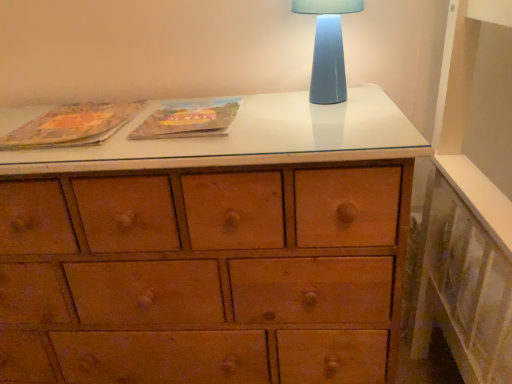
Question: Should I look upward or downward to see matte paper book at upper left, placed as the second paperback book when sorted from right to left?

Choices:
 (A) down
 (B) up

Answer: (B)

Question: Is blue ceramic table lamp at upper right thinner than matte cardboard book at center, marked as the first paperback book in a right-to-left arrangement?

Choices:
 (A) yes
 (B) no

Answer: (A)

Question: From the image's perspective, would you say blue ceramic table lamp at upper right is shown under matte cardboard book at center, marked as the second paperback book in a left-to-right arrangement?

Choices:
 (A) no
 (B) yes

Answer: (A)

Question: Is blue ceramic table lamp at upper right bigger than matte cardboard book at center, marked as the first paperback book in a right-to-left arrangement?

Choices:
 (A) no
 (B) yes

Answer: (B)

Question: Is blue ceramic table lamp at upper right facing away from matte cardboard book at center, marked as the first paperback book in a right-to-left arrangement?

Choices:
 (A) no
 (B) yes

Answer: (A)

Question: Is blue ceramic table lamp at upper right facing towards matte cardboard book at center, marked as the second paperback book in a left-to-right arrangement?

Choices:
 (A) no
 (B) yes

Answer: (A)

Question: Is the position of blue ceramic table lamp at upper right less distant than that of matte cardboard book at center, marked as the second paperback book in a left-to-right arrangement?

Choices:
 (A) yes
 (B) no

Answer: (B)

Question: From a real-world perspective, is matte paper book at upper left, marked as the first paperback book in a left-to-right arrangement, positioned over blue ceramic table lamp at upper right based on gravity?

Choices:
 (A) yes
 (B) no

Answer: (B)

Question: Could you tell me if matte paper book at upper left, placed as the second paperback book when sorted from right to left, is facing blue ceramic table lamp at upper right?

Choices:
 (A) no
 (B) yes

Answer: (A)

Question: Considering the relative positions of matte paper book at upper left, marked as the first paperback book in a left-to-right arrangement, and blue ceramic table lamp at upper right in the image provided, is matte paper book at upper left, marked as the first paperback book in a left-to-right arrangement, to the right of blue ceramic table lamp at upper right from the viewer's perspective?

Choices:
 (A) no
 (B) yes

Answer: (A)

Question: Is matte paper book at upper left, marked as the first paperback book in a left-to-right arrangement, next to blue ceramic table lamp at upper right and touching it?

Choices:
 (A) yes
 (B) no

Answer: (B)

Question: Is matte paper book at upper left, marked as the first paperback book in a left-to-right arrangement, wider than blue ceramic table lamp at upper right?

Choices:
 (A) no
 (B) yes

Answer: (B)

Question: Does matte paper book at upper left, placed as the second paperback book when sorted from right to left, have a lesser width compared to blue ceramic table lamp at upper right?

Choices:
 (A) yes
 (B) no

Answer: (B)

Question: Is blue ceramic table lamp at upper right wider than matte paper book at upper left, placed as the second paperback book when sorted from right to left?

Choices:
 (A) yes
 (B) no

Answer: (B)